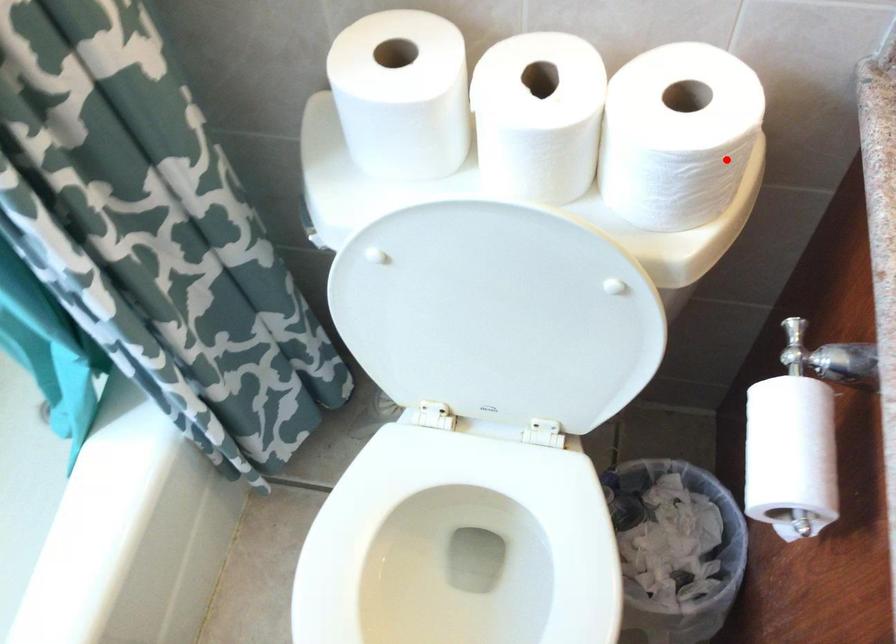
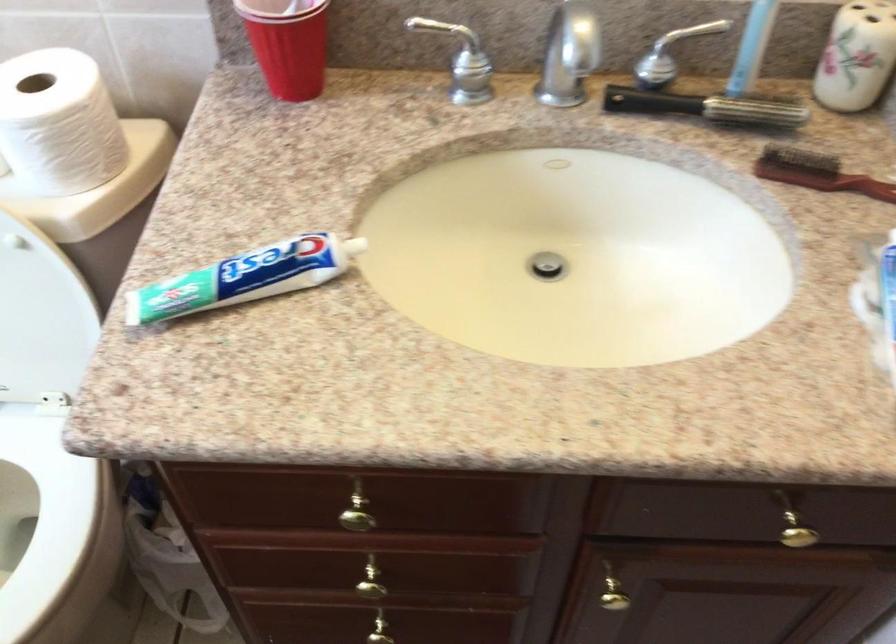
Question: I am providing you with two images of the same scene from different viewpoints. A red point is shown in image1. For the corresponding object point in image2, is it positioned nearer or farther from the camera?

Choices:
 (A) Nearer
 (B) Farther

Answer: (B)